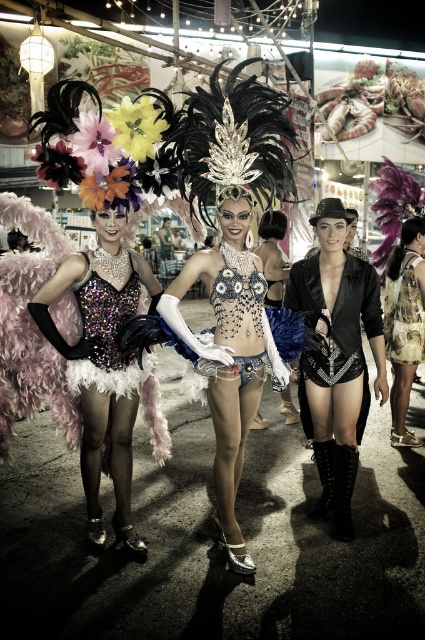
Is point (113, 364) positioned after point (404, 316)?

No, it is not.

Which is behind, point (129, 307) or point (408, 333)?

The point (408, 333) is more distant.

The image size is (425, 640). What are the coordinates of `sparkly sequined bodysuit at center` in the screenshot? It's located at tap(107, 337).

Who is taller, printed fabric dress at center or sparkly sequined bodysuit at center?

Standing taller between the two is printed fabric dress at center.

Is point (391, 324) less distant than point (129, 369)?

No, (391, 324) is further to viewer.

Locate an element on the screen. This screenshot has height=640, width=425. printed fabric dress at center is located at coordinates (405, 323).

Image resolution: width=425 pixels, height=640 pixels. Describe the element at coordinates (102, 362) in the screenshot. I see `sparkly sequin dress at center` at that location.

Between point (102, 253) and point (376, 324), which one is positioned in front?

Point (102, 253) is in front.

Locate an element on the screen. The height and width of the screenshot is (640, 425). sparkly sequin dress at center is located at coordinates pyautogui.click(x=102, y=362).